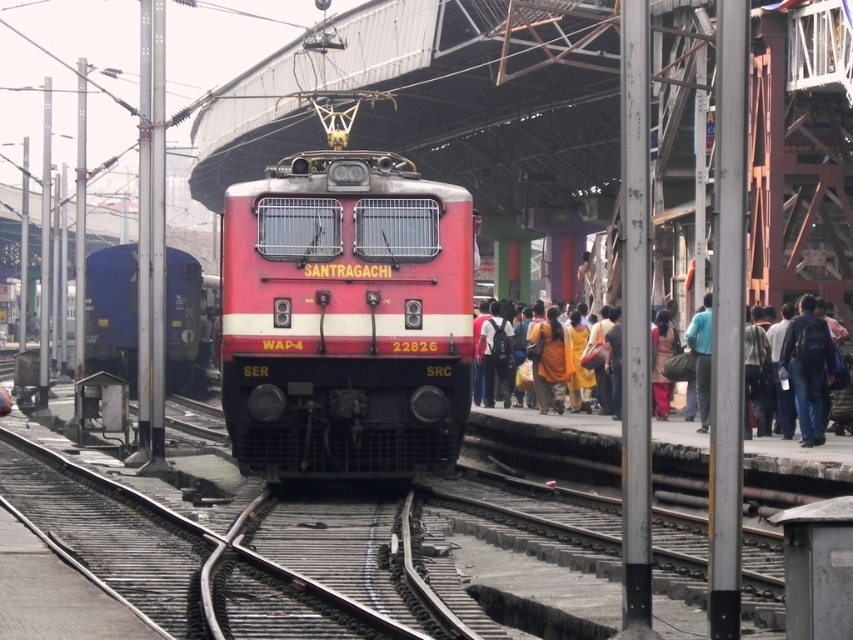
You are a passenger standing at the center of the platform in the railway station scene. You need to board the red locomotive labeled SANTRAGACHI 22826. Where should you stand relative to the blue matte freight car at left to board the locomotive?

The blue matte freight car at left is located at point (111, 310). Since the red locomotive is at the center of the frame, you should stand opposite to the blue matte freight car at left to board the locomotive.

You are a photographer standing on the platform at the railway station. You want to take a photo of the matte red train at center and the yellow cotton dress at right. Which object will appear larger in your photo?

The matte red train at center will appear larger in the photo because it is closer to the photographer than the yellow cotton dress at right.

You are a passenger standing on the platform and want to board the matte red train at center. Is the blue matte freight car at left blocking your path to the train?

The matte red train at center is in front of the blue matte freight car at left, so the freight car is behind the train. Therefore, the blue matte freight car at left is not blocking your path to the matte red train at center.